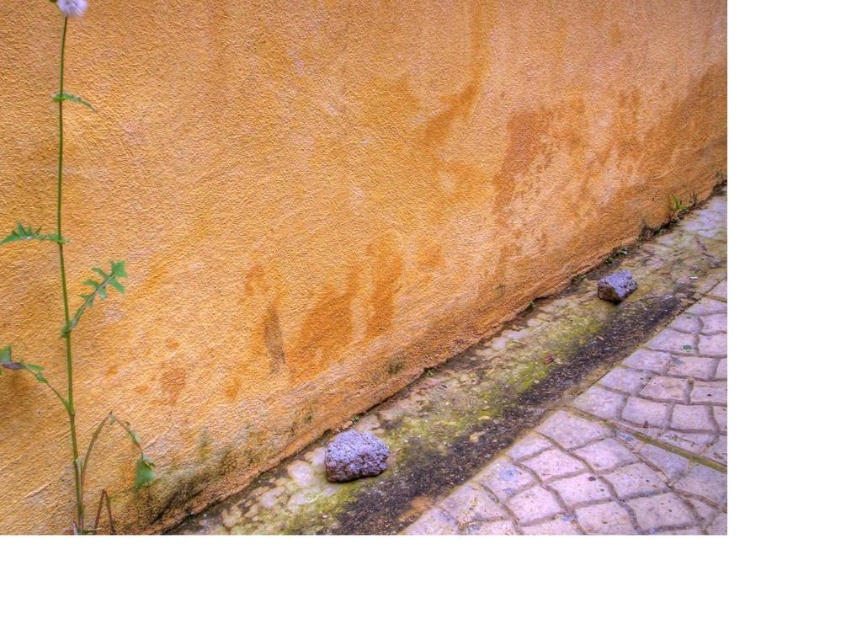
Question: Which of these objects is positioned closest to the gray stone curb at lower right?

Choices:
 (A) white fluffy flower at upper left
 (B) green leafy stem at left
 (C) gray rough rock at lower right

Answer: (C)

Question: Can you confirm if green leafy stem at left is thinner than white fluffy flower at upper left?

Choices:
 (A) yes
 (B) no

Answer: (B)

Question: Can you confirm if brown stone pavement at lower right is positioned above white fluffy flower at upper left?

Choices:
 (A) yes
 (B) no

Answer: (B)

Question: Does gray stone curb at lower right lie in front of gray rough stone at center?

Choices:
 (A) no
 (B) yes

Answer: (B)

Question: Which of the following is the closest to the observer?

Choices:
 (A) (694, 321)
 (B) (633, 285)

Answer: (A)

Question: Which point appears farthest from the camera in this image?

Choices:
 (A) (656, 404)
 (B) (69, 3)

Answer: (A)